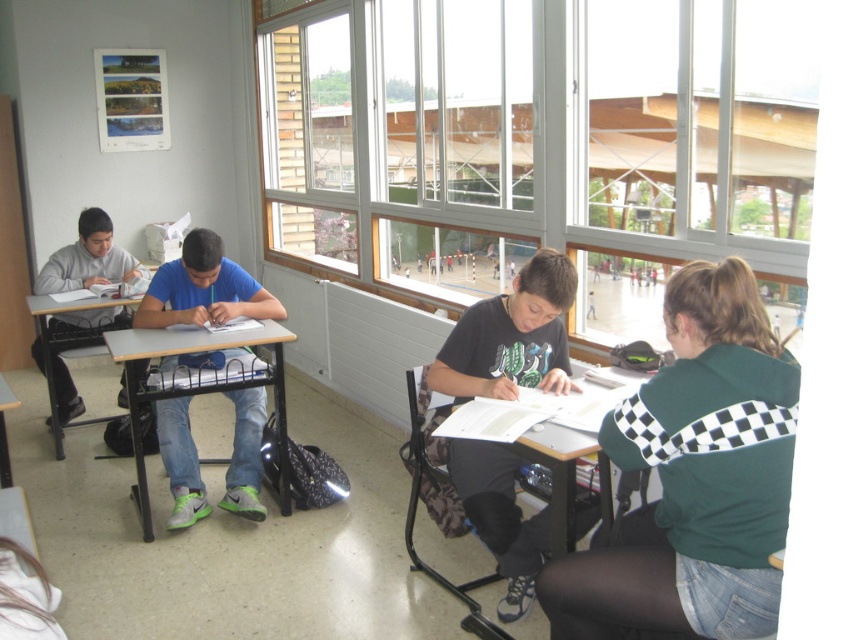
In the scene shown: How far apart are black matte shirt at center and matte black desk at lower right?

black matte shirt at center and matte black desk at lower right are 3.27 inches apart.

Locate an element on the screen. black matte shirt at center is located at coordinates (511, 337).

Locate an element on the screen. This screenshot has width=853, height=640. black matte shirt at center is located at coordinates (511, 337).

Which is in front, point (579, 588) or point (515, 506)?

Point (579, 588) is in front.

Between point (641, 589) and point (519, 556), which one is positioned behind?

The point (519, 556) is behind.

Describe the element at coordinates (694, 477) in the screenshot. The height and width of the screenshot is (640, 853). I see `green checkered jacket at lower right` at that location.

In order to click on green checkered jacket at lower right in this screenshot , I will do `click(694, 477)`.

Does matte black desk at lower right appear under wooden desk at left?

Indeed, matte black desk at lower right is positioned under wooden desk at left.

Does matte black desk at lower right come in front of wooden desk at left?

Yes, matte black desk at lower right is in front of wooden desk at left.

Where is `matte black desk at lower right`? The height and width of the screenshot is (640, 853). matte black desk at lower right is located at coordinates (502, 516).